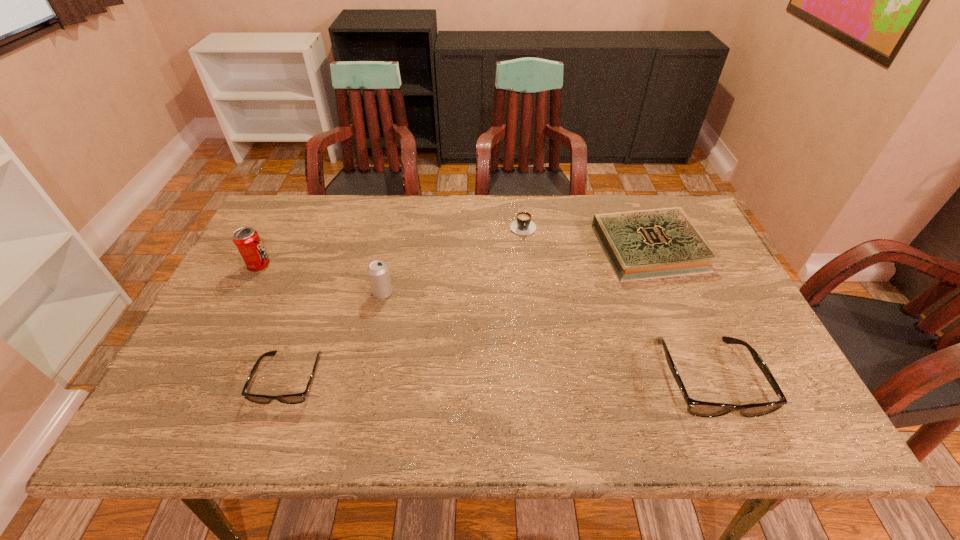
What are the coordinates of `unoccupied position between the shorter spectacles and the right spectacles` in the screenshot? It's located at (498, 379).

This screenshot has width=960, height=540. I want to click on vacant point located between the fifth shortest object and the left spectacles, so click(x=336, y=336).

Where is `free spot between the shorter spectacles and the tallest object`? Image resolution: width=960 pixels, height=540 pixels. free spot between the shorter spectacles and the tallest object is located at coordinates (275, 322).

At what (x,y) coordinates should I click in order to perform the action: click on free area in between the shorter spectacles and the fourth shortest object. Please return your answer as a coordinate pair (x, y). Looking at the image, I should click on (498, 379).

At what (x,y) coordinates should I click in order to perform the action: click on unoccupied position between the cappuccino and the fourth farthest object. Please return your answer as a coordinate pair (x, y). Looking at the image, I should click on (453, 259).

Locate an element on the screen. The height and width of the screenshot is (540, 960). free space between the right spectacles and the third nearest object is located at coordinates (545, 336).

What are the coordinates of `object that ranks as the fifth closest to the taller spectacles` in the screenshot? It's located at (246, 240).

The image size is (960, 540). In order to click on object that is the third closest to the tallest object in this screenshot , I will do `click(523, 225)`.

Identify the location of free space that satisfies the following two spatial constraints: 1. on the front side of the third nearest object; 2. on the left side of the tallest object. (245, 293).